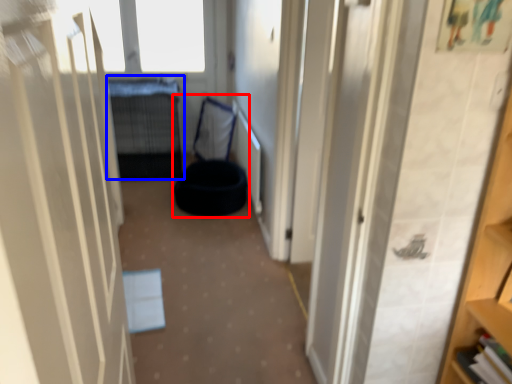
Question: Which point is further to the camera, bean bag chair (highlighted by a red box) or bed (highlighted by a blue box)?

Choices:
 (A) bean bag chair
 (B) bed

Answer: (A)